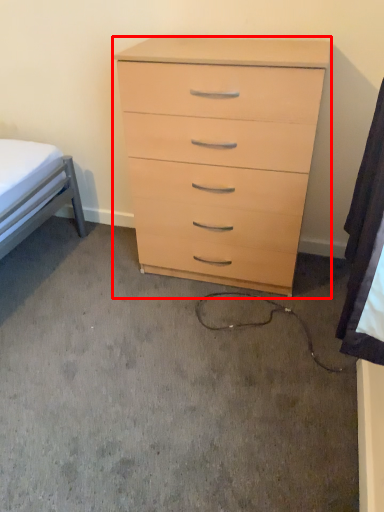
Question: From the image's perspective, considering the relative positions of chest of drawers (annotated by the red box) and sheet in the image provided, where is chest of drawers (annotated by the red box) located with respect to the staircase?

Choices:
 (A) below
 (B) above

Answer: (B)